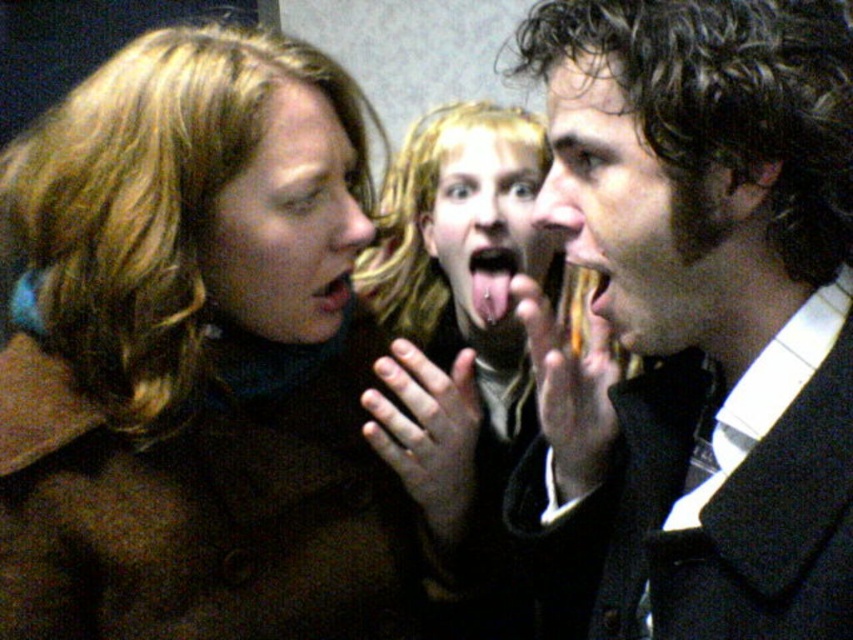
You are a photographer trying to capture a candid shot of the brown woolen coat at left and the smooth skin face at center. Your camera has a lens that can focus on objects within a 15 inch range. Can you fit both subjects into the frame without moving your position?

The distance between the brown woolen coat at left and the smooth skin face at center is 17.41 inches. Since the camera lens can only focus within a 15 inch range, the two subjects are slightly out of the focus range. You might need to adjust your position or use a different lens to capture both clearly.

You are standing in the center of the room and want to grab the brown woolen coat at left. Which direction should you move to reach it?

The brown woolen coat at left is located at point (x=195, y=356), so you should move to the left to reach it.

You are a photographer trying to capture a candid shot of the smooth blonde hair at center and the smooth glossy tongue at center. Which one is located to the left of the other?

The smooth blonde hair at center is positioned on the left side of smooth glossy tongue at center.